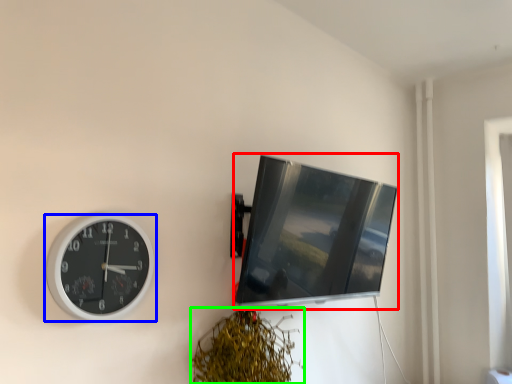
Question: Based on their relative distances, which object is farther from computer monitor (highlighted by a red box)? Choose from wall clock (highlighted by a blue box) and vegetation (highlighted by a green box).

Choices:
 (A) wall clock
 (B) vegetation

Answer: (A)